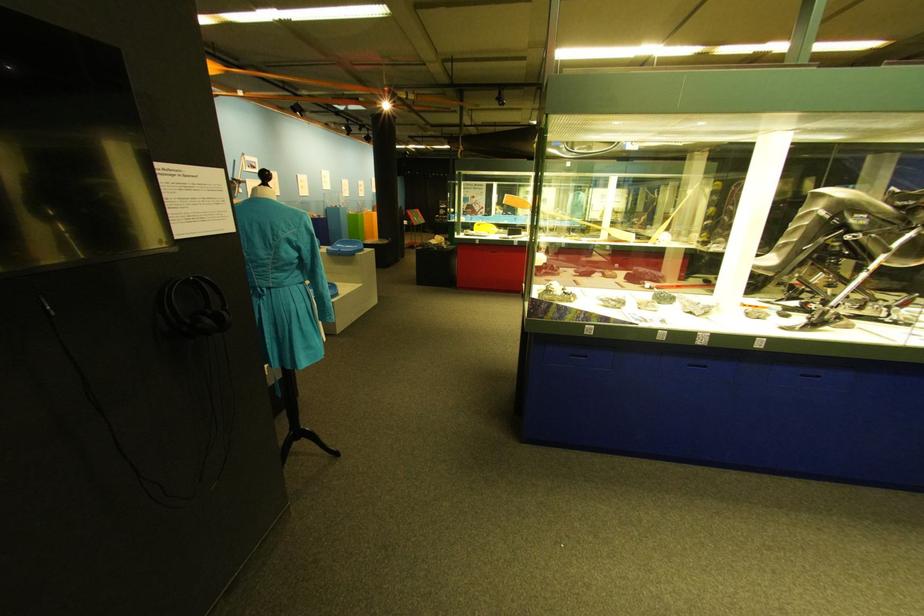
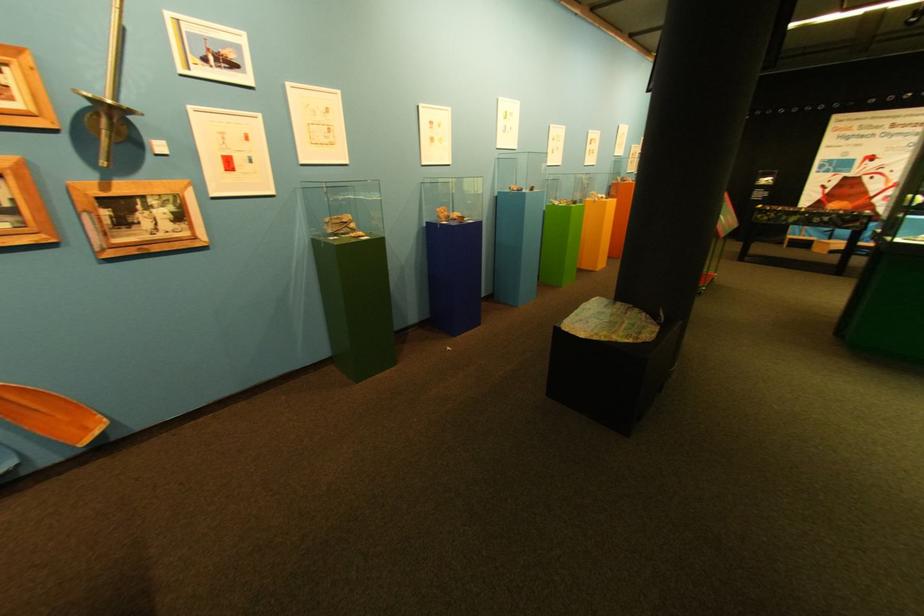
Find the pixel in the second image that matches the point at 317,182 in the first image.

(445, 124)